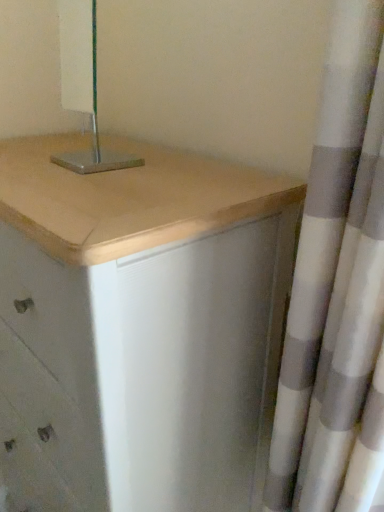
Question: Does matte white chest of drawers at center lie in front of white textured curtain at right?

Choices:
 (A) no
 (B) yes

Answer: (A)

Question: Can you confirm if matte white chest of drawers at center is bigger than white textured curtain at right?

Choices:
 (A) yes
 (B) no

Answer: (A)

Question: From the image's perspective, is matte white chest of drawers at center located above white textured curtain at right?

Choices:
 (A) yes
 (B) no

Answer: (B)

Question: Does matte white chest of drawers at center turn towards white textured curtain at right?

Choices:
 (A) no
 (B) yes

Answer: (A)

Question: Is white textured curtain at right at the back of matte white chest of drawers at center?

Choices:
 (A) yes
 (B) no

Answer: (B)

Question: Is matte white chest of drawers at center further to camera compared to white textured curtain at right?

Choices:
 (A) no
 (B) yes

Answer: (B)

Question: Is matte white chest of drawers at center smaller than metallic silver lamp at upper center?

Choices:
 (A) yes
 (B) no

Answer: (B)

Question: From the image's perspective, is matte white chest of drawers at center above metallic silver lamp at upper center?

Choices:
 (A) no
 (B) yes

Answer: (A)

Question: Does matte white chest of drawers at center have a greater width compared to metallic silver lamp at upper center?

Choices:
 (A) yes
 (B) no

Answer: (A)

Question: Can you confirm if matte white chest of drawers at center is shorter than metallic silver lamp at upper center?

Choices:
 (A) yes
 (B) no

Answer: (B)

Question: Could you tell me if matte white chest of drawers at center is turned towards metallic silver lamp at upper center?

Choices:
 (A) yes
 (B) no

Answer: (B)

Question: Is matte white chest of drawers at center not within metallic silver lamp at upper center?

Choices:
 (A) yes
 (B) no

Answer: (A)

Question: Does metallic silver lamp at upper center have a lesser height compared to matte white chest of drawers at center?

Choices:
 (A) yes
 (B) no

Answer: (A)